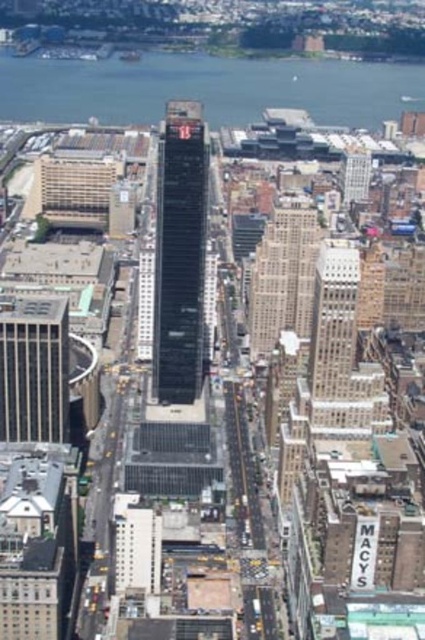
Question: Can you confirm if gray concrete skyscraper at left is wider than beige stone building at center?

Choices:
 (A) yes
 (B) no

Answer: (A)

Question: Which point is closer to the camera?

Choices:
 (A) gray concrete skyscraper at left
 (B) black glass building at center
 (C) beige stone building at center

Answer: (C)

Question: Which point is farther to the camera?

Choices:
 (A) (159, 394)
 (B) (274, 209)

Answer: (B)

Question: Is black glass building at center positioned in front of beige stone building at center?

Choices:
 (A) no
 (B) yes

Answer: (A)

Question: Can you confirm if gray concrete skyscraper at left is bigger than beige stone building at center?

Choices:
 (A) no
 (B) yes

Answer: (B)

Question: Estimate the real-world distances between objects in this image. Which object is closer to the black glass building at center?

Choices:
 (A) beige stone building at center
 (B) gray concrete skyscraper at left

Answer: (A)